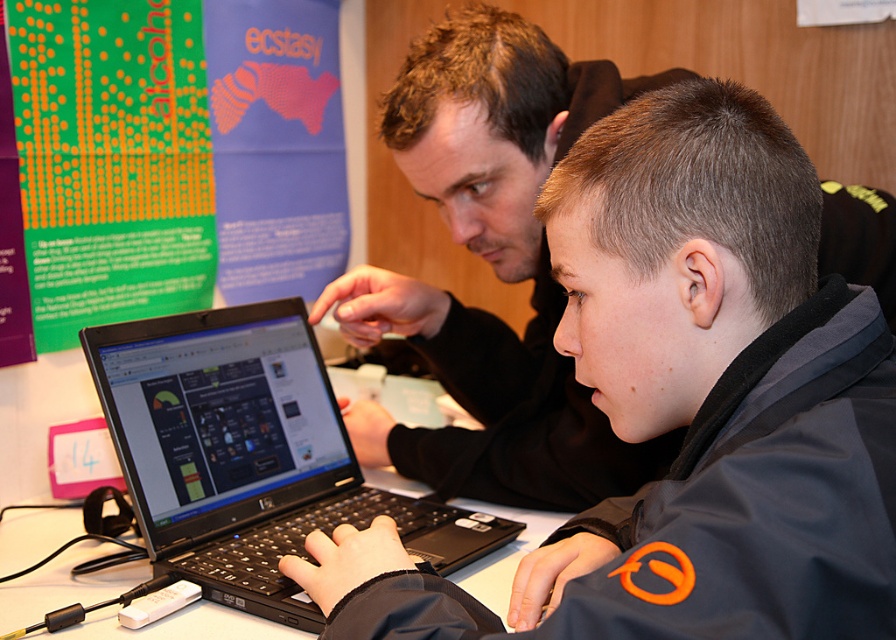
Question: Does green paper at upper left appear over black plastic laptop at center?

Choices:
 (A) no
 (B) yes

Answer: (B)

Question: Is green paper at upper left thinner than black plastic laptop at center?

Choices:
 (A) yes
 (B) no

Answer: (A)

Question: Among these points, which one is farthest from the camera?

Choices:
 (A) pyautogui.click(x=116, y=442)
 (B) pyautogui.click(x=497, y=365)

Answer: (B)

Question: Which object is closer to the camera taking this photo?

Choices:
 (A) black plastic laptop at center
 (B) green paper at upper left
 (C) white plastic table at center

Answer: (A)

Question: Does black matte laptop at left appear on the left side of white plastic table at center?

Choices:
 (A) yes
 (B) no

Answer: (B)

Question: Which is farther from the black matte laptop at left?

Choices:
 (A) white plastic table at center
 (B) green paper at upper left

Answer: (B)